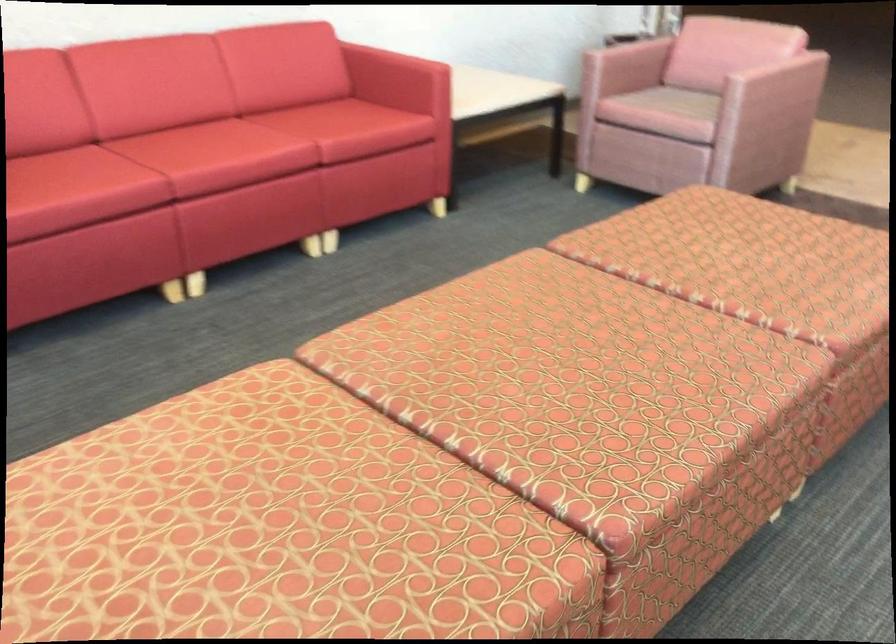
Image resolution: width=896 pixels, height=644 pixels. I want to click on chair armrest, so click(x=627, y=58).